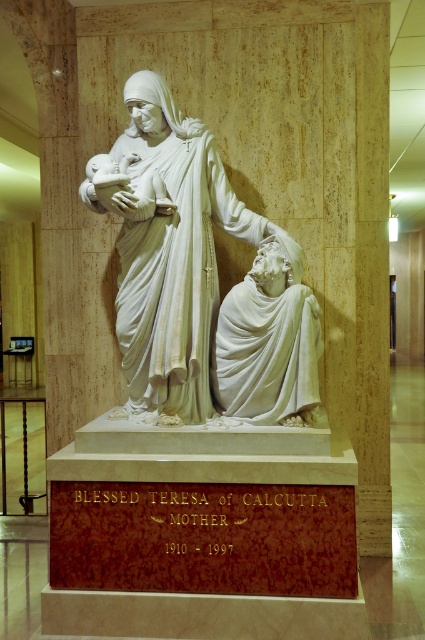
Question: Which of the following is the farthest from the observer?

Choices:
 (A) pos(223,324)
 (B) pos(141,332)

Answer: (A)

Question: Can you confirm if white marble statue at center is thinner than white marble statue at lower right?

Choices:
 (A) yes
 (B) no

Answer: (B)

Question: Which of the following is the closest to the observer?

Choices:
 (A) white marble statue at center
 (B) white marble statue at lower right

Answer: (B)

Question: Is white marble statue at center thinner than white marble statue at lower right?

Choices:
 (A) no
 (B) yes

Answer: (A)

Question: Can you confirm if white marble statue at center is positioned to the left of white marble statue at lower right?

Choices:
 (A) no
 (B) yes

Answer: (B)